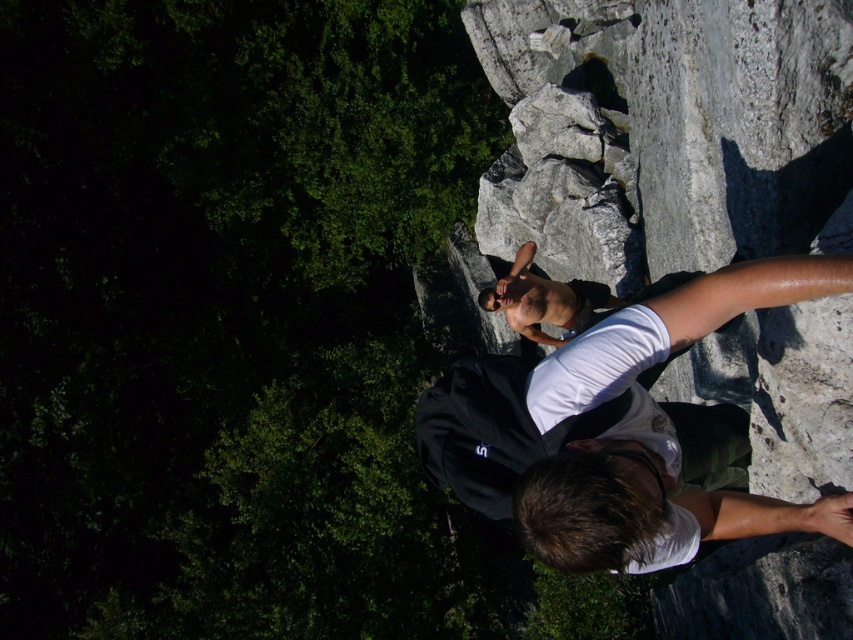
You are a photographer aiming to capture both the shiny black shirt at center and the shiny skin torso at center in a single clear shot. However, due to the cliff edge being narrow, you can only focus on one subject at a time. Which subject should you focus on to ensure the other remains visible in the background?

You should focus on the shiny black shirt at center because it is in front of the shiny skin torso at center, so the latter will be visible in the background.